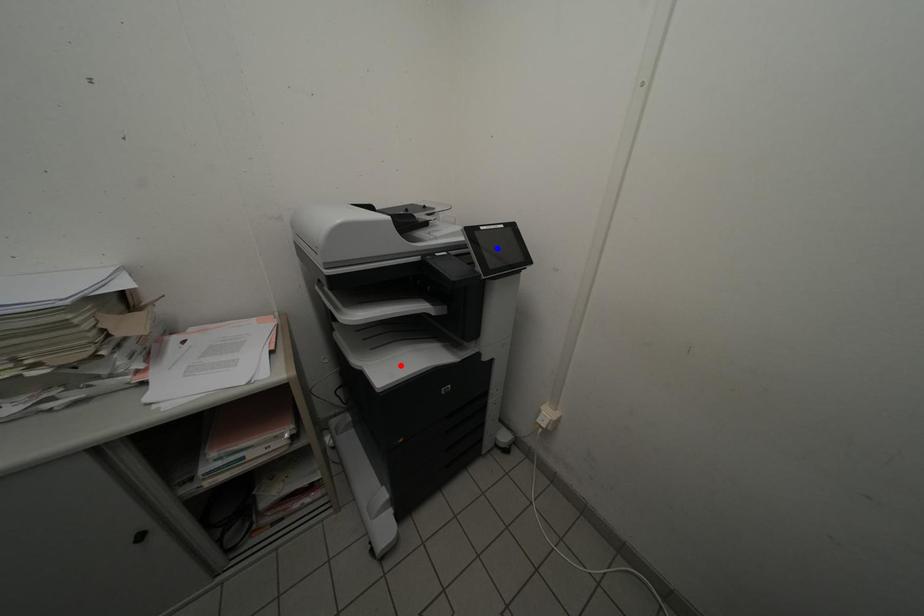
Question: Which of the two points in the image is closer to the camera?

Choices:
 (A) Blue point is closer.
 (B) Red point is closer.

Answer: (A)